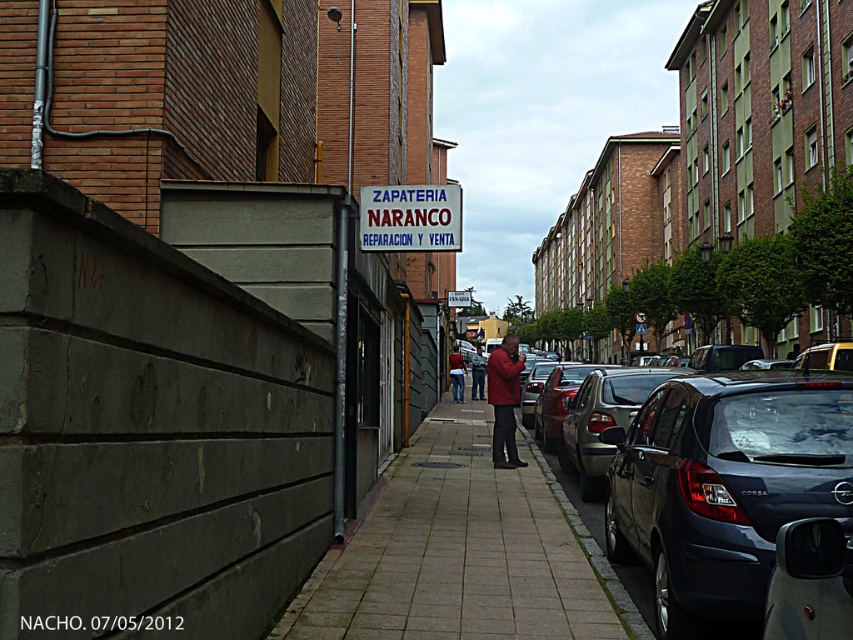
You are a pedestrian standing on the sidewalk looking at the matte black corsa at center and the matte red jacket at center. Which object appears bigger to you?

The matte black corsa at center appears bigger than the matte red jacket at center.

You are a delivery person trying to place a package on the gray concrete sidewalk at center and the dark blue jeans at center. Which object is suitable for placing the package?

The gray concrete sidewalk at center is suitable for placing the package since it is positioned under the dark blue jeans at center, making it a stable surface.